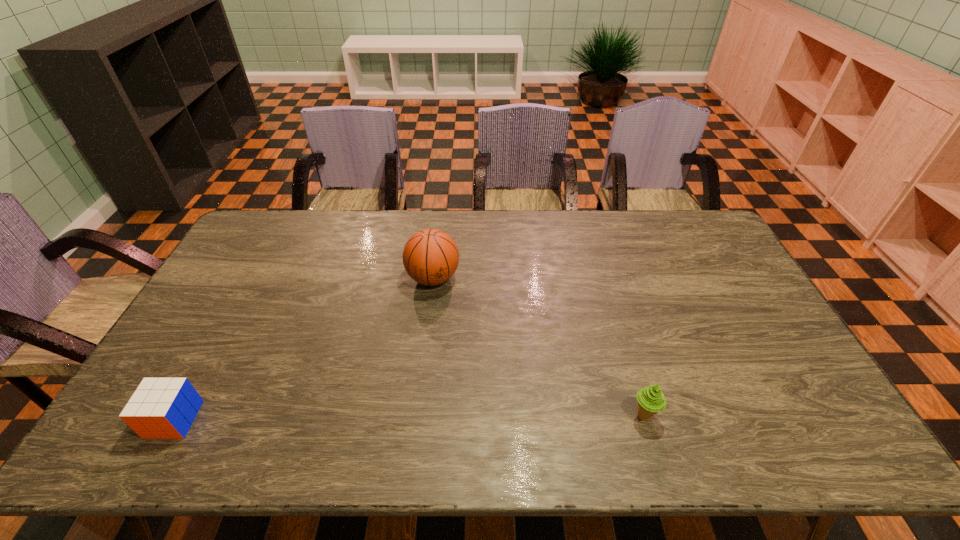
The height and width of the screenshot is (540, 960). Identify the location of the farthest object. (430, 256).

The image size is (960, 540). What are the coordinates of `the tallest object` in the screenshot? It's located at (430, 256).

Locate an element on the screen. icecream is located at coordinates (651, 400).

Identify the location of the second shortest object. Image resolution: width=960 pixels, height=540 pixels. (651, 400).

Where is `the shortest object`? The width and height of the screenshot is (960, 540). the shortest object is located at coordinates (161, 408).

Locate an element on the screen. This screenshot has width=960, height=540. the leftmost object is located at coordinates (161, 408).

The image size is (960, 540). Identify the location of free space located on the back of the farthest object. (437, 246).

This screenshot has width=960, height=540. I want to click on blank space located 0.260m on the back of the icecream, so click(616, 325).

Where is `vacant region located 0.100m on the right of the cube`? The image size is (960, 540). vacant region located 0.100m on the right of the cube is located at coordinates (236, 419).

The image size is (960, 540). Identify the location of icecream at the near edge. (651, 400).